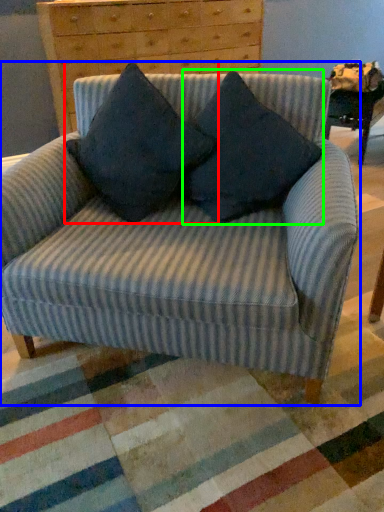
Question: Estimate the real-world distances between objects in this image. Which object is farther from pillow (highlighted by a red box), chair (highlighted by a blue box) or pillow (highlighted by a green box)?

Choices:
 (A) chair
 (B) pillow

Answer: (A)